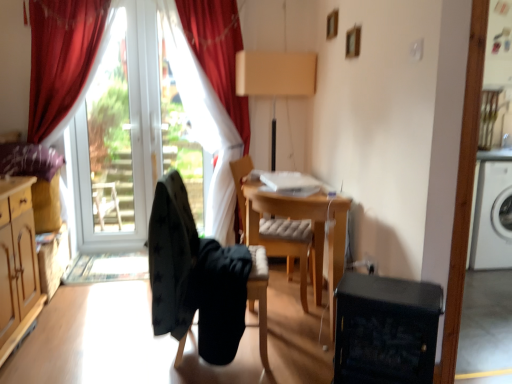
The height and width of the screenshot is (384, 512). Identify the location of vacant space situated above black plastic dishwasher at lower right (from a real-world perspective). (388, 286).